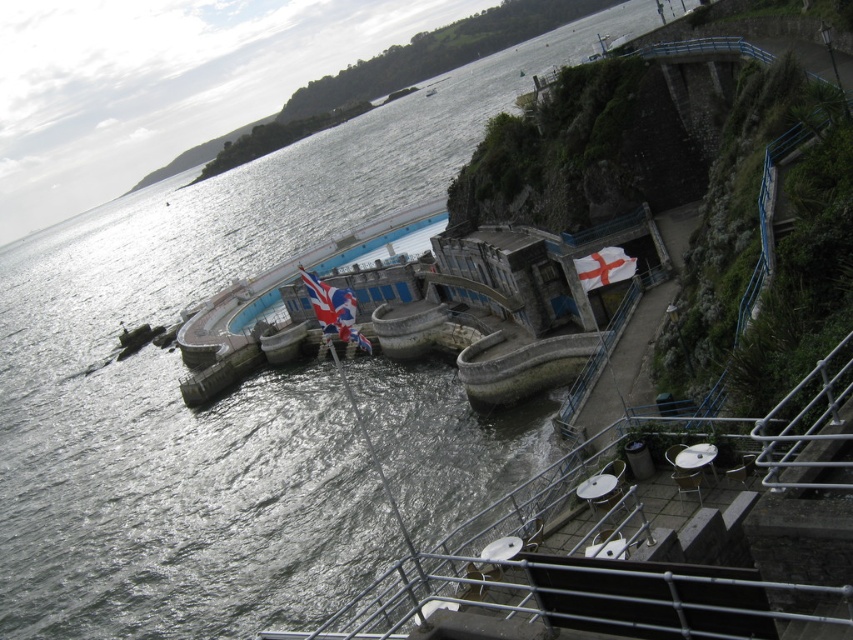
From the picture: Is union jack fabric flag at center positioned behind white fabric flag at upper right?

No, union jack fabric flag at center is closer to the viewer.

Does union jack fabric flag at center appear on the right side of white fabric flag at upper right?

No, union jack fabric flag at center is not to the right of white fabric flag at upper right.

Is point (352, 326) farther from camera compared to point (608, 252)?

No, (352, 326) is closer to viewer.

Locate an element on the screen. union jack fabric flag at center is located at coordinates (334, 308).

Between blue concrete pool at center and white fabric flag at upper right, which one appears on the right side from the viewer's perspective?

white fabric flag at upper right is more to the right.

Where is `blue concrete pool at center`? Image resolution: width=853 pixels, height=640 pixels. blue concrete pool at center is located at coordinates (386, 243).

What are the coordinates of `blue concrete pool at center` in the screenshot? It's located at (386, 243).

Between point (370, 243) and point (368, 348), which one is positioned in front?

Positioned in front is point (368, 348).

Can you confirm if blue concrete pool at center is shorter than union jack fabric flag at center?

No, blue concrete pool at center is not shorter than union jack fabric flag at center.

Measure the distance between point (x=228, y=326) and camera.

Point (x=228, y=326) is 233.30 feet away from camera.

Image resolution: width=853 pixels, height=640 pixels. Find the location of `blue concrete pool at center`. blue concrete pool at center is located at coordinates (386, 243).